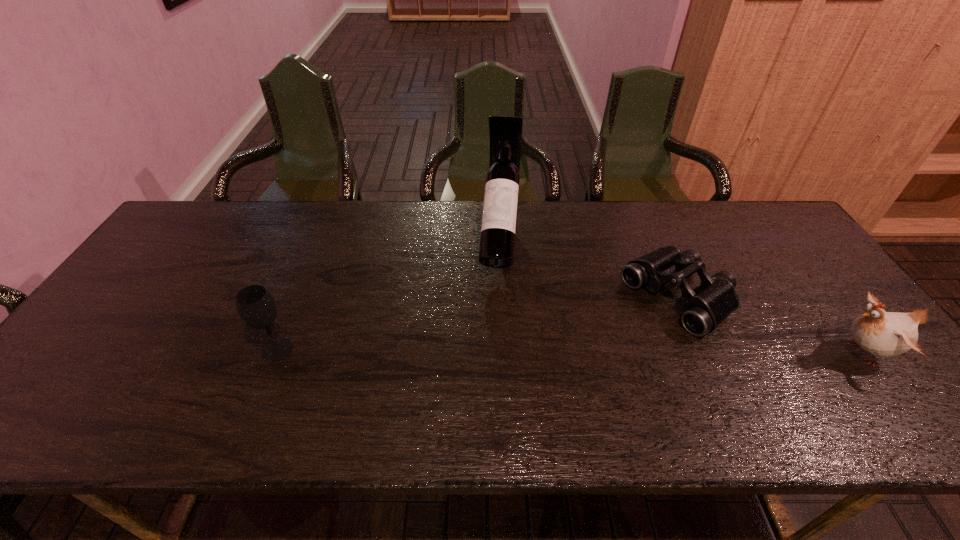
Identify the location of blank area in the image that satisfies the following two spatial constraints: 1. on the front side of the binoculars; 2. at the beak of the rightmost object. The image size is (960, 540). (703, 353).

Identify the location of vacant space that satisfies the following two spatial constraints: 1. on the front side of the shortest object; 2. on the left side of the third object from right to left. This screenshot has height=540, width=960. (502, 299).